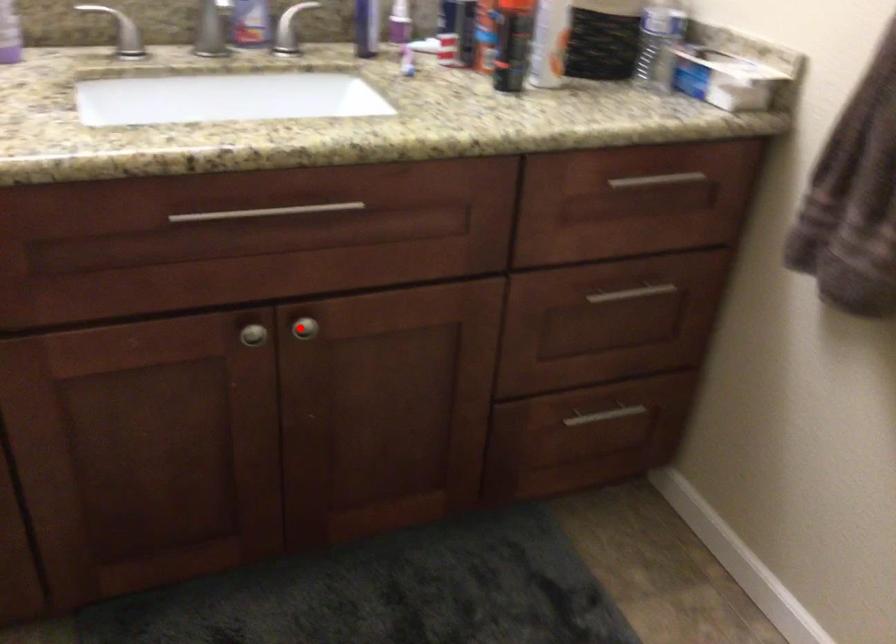
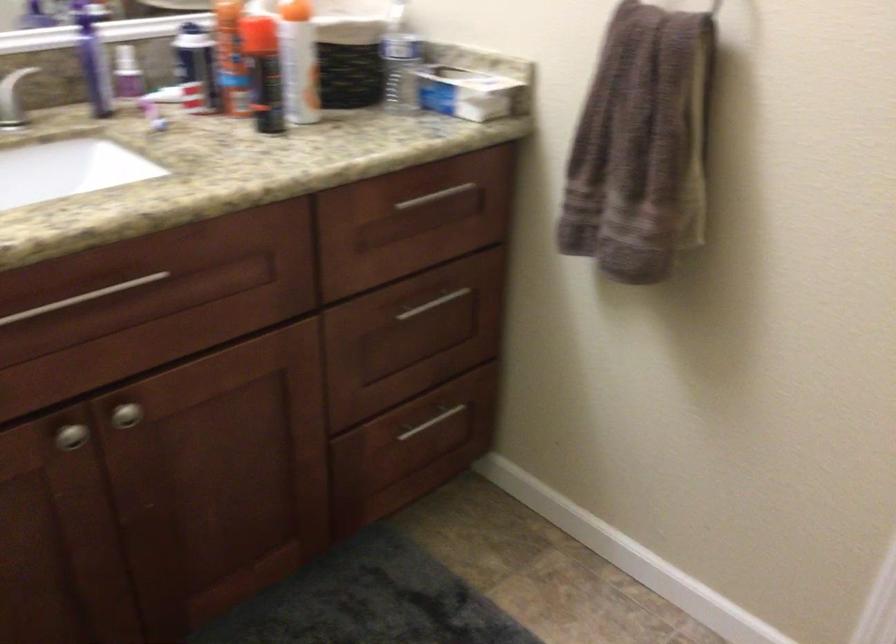
The point at the highlighted location is marked in the first image. Where is the corresponding point in the second image?

(125, 415)